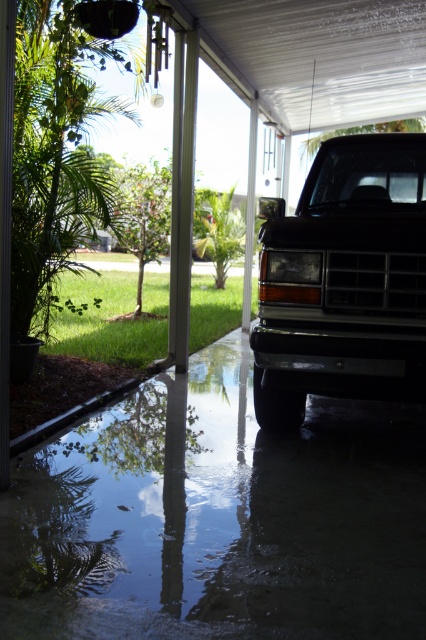
You are a delivery person trying to park your car on the glossy concrete flood at lower center. However, there is already a black matte truck at center parked there. Based on the scene, can you park your car to the right side of the truck without overlapping it?

The glossy concrete flood at lower center is to the left of the black matte truck at center, so the truck is actually on the right side of the flood. Therefore, you can park your car to the right side of the truck since there is space available on the glossy concrete flood at lower center which is positioned to the left of the truck.

Looking at this image, you are a delivery person trying to park your car on the glossy concrete flood at lower center. The black matte truck at center is already parked there. Can you safely park your car next to the truck without getting your car submerged in the flood?

The glossy concrete flood at lower center has a lesser height compared to the black matte truck at center, which means the flood level is lower than the truck. Since the truck is parked there without being submerged, your car can also park safely next to it as the flood depth is not enough to submerge it.